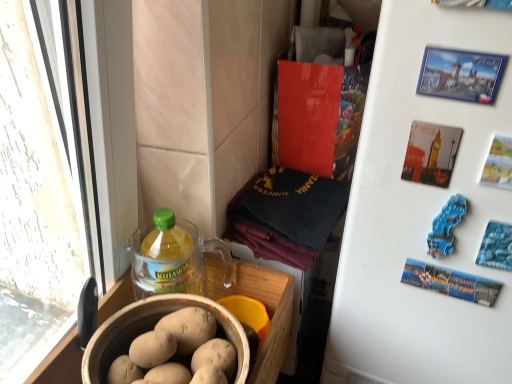
Question: Can you confirm if translucent plastic bottle at lower left is positioned to the right of blue plastic magnet at upper right?

Choices:
 (A) yes
 (B) no

Answer: (B)

Question: Is translucent plastic bottle at lower left outside blue plastic magnet at upper right?

Choices:
 (A) yes
 (B) no

Answer: (A)

Question: Considering the relative sizes of translucent plastic bottle at lower left and blue plastic magnet at upper right in the image provided, is translucent plastic bottle at lower left shorter than blue plastic magnet at upper right?

Choices:
 (A) yes
 (B) no

Answer: (B)

Question: Is translucent plastic bottle at lower left placed right next to blue plastic magnet at upper right?

Choices:
 (A) no
 (B) yes

Answer: (A)

Question: Is translucent plastic bottle at lower left far from blue plastic magnet at upper right?

Choices:
 (A) no
 (B) yes

Answer: (A)

Question: Is translucent plastic bottle at lower left positioned with its back to blue plastic magnet at upper right?

Choices:
 (A) yes
 (B) no

Answer: (B)

Question: From the image's perspective, is blue plastic magnet at upper right located beneath translucent plastic bottle at lower left?

Choices:
 (A) no
 (B) yes

Answer: (A)

Question: Considering the relative sizes of blue plastic magnet at upper right and translucent plastic bottle at lower left in the image provided, is blue plastic magnet at upper right bigger than translucent plastic bottle at lower left?

Choices:
 (A) yes
 (B) no

Answer: (B)

Question: Considering the relative positions of blue plastic magnet at upper right and translucent plastic bottle at lower left in the image provided, is blue plastic magnet at upper right to the right of translucent plastic bottle at lower left from the viewer's perspective?

Choices:
 (A) no
 (B) yes

Answer: (B)

Question: Is the position of blue plastic magnet at upper right more distant than that of translucent plastic bottle at lower left?

Choices:
 (A) yes
 (B) no

Answer: (B)

Question: Does blue plastic magnet at upper right have a greater height compared to translucent plastic bottle at lower left?

Choices:
 (A) no
 (B) yes

Answer: (A)

Question: Can you confirm if blue plastic magnet at upper right is smaller than translucent plastic bottle at lower left?

Choices:
 (A) yes
 (B) no

Answer: (A)

Question: Is matte brown bowl at lower left shorter than translucent plastic bottle at lower left?

Choices:
 (A) no
 (B) yes

Answer: (B)